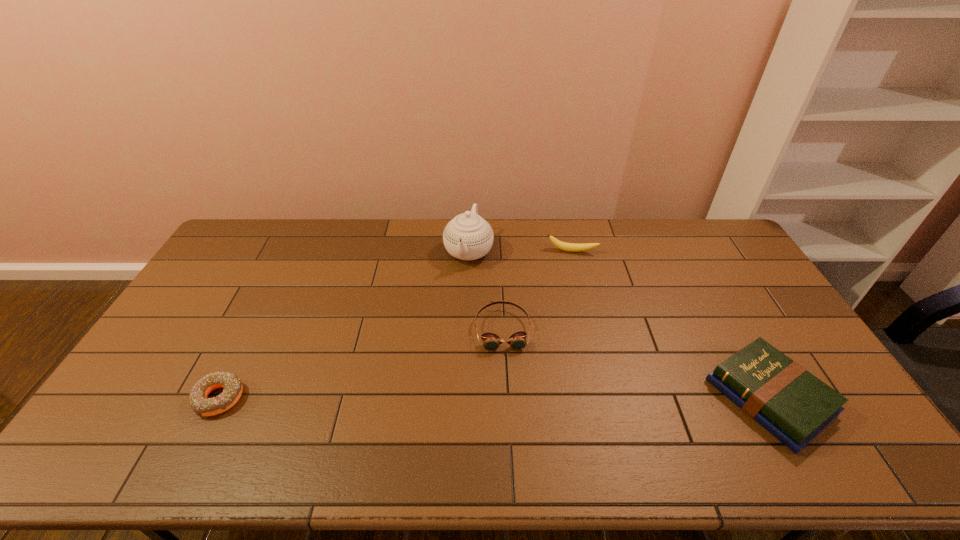
The height and width of the screenshot is (540, 960). Find the location of `book that is at the near edge`. book that is at the near edge is located at coordinates (792, 404).

You are a GUI agent. You are given a task and a screenshot of the screen. Output one action in this format:
    pyautogui.click(x=<x>, y=<y>)
    Task: Click on the object that is at the right edge
    Image resolution: width=960 pixels, height=540 pixels.
    Given the screenshot: What is the action you would take?
    pyautogui.click(x=792, y=404)

Find the location of a particular element. object present at the near right corner is located at coordinates (792, 404).

You are a GUI agent. You are given a task and a screenshot of the screen. Output one action in this format:
    pyautogui.click(x=<x>, y=<y>)
    Task: Click on the vacant space at the far edge of the desktop
    
    Given the screenshot: What is the action you would take?
    pyautogui.click(x=684, y=241)

You are a GUI agent. You are given a task and a screenshot of the screen. Output one action in this format:
    pyautogui.click(x=<x>, y=<y>)
    Task: Click on the vacant space at the near edge
    The image size is (960, 540).
    Given the screenshot: What is the action you would take?
    click(x=265, y=401)

Identify the location of vacant space at the right edge of the desktop. The width and height of the screenshot is (960, 540). (792, 338).

I want to click on free space at the near left corner, so click(141, 416).

Where is `vacant region between the goggles and the chinaware`? This screenshot has width=960, height=540. vacant region between the goggles and the chinaware is located at coordinates (486, 291).

I want to click on free space between the doughnut and the banana, so click(x=396, y=325).

This screenshot has width=960, height=540. Identify the location of free space that is in between the second object from right to left and the shortest object. (396, 325).